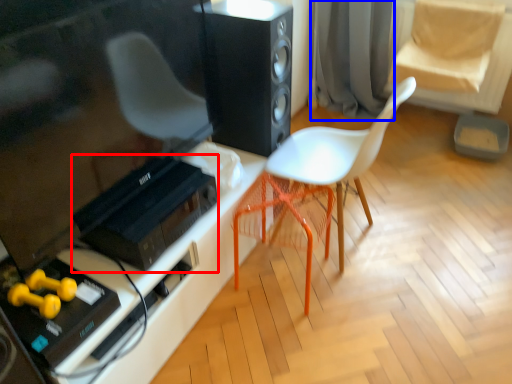
Question: Which of the following is the farthest to the observer, stereo (highlighted by a red box) or curtain (highlighted by a blue box)?

Choices:
 (A) stereo
 (B) curtain

Answer: (B)